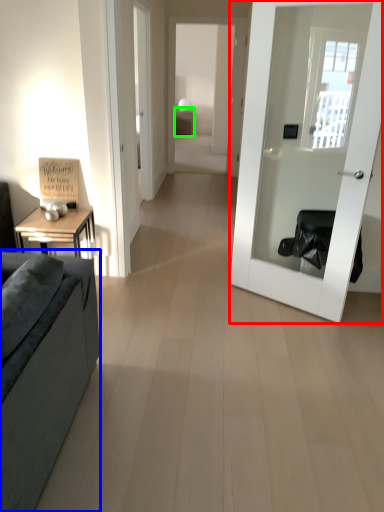
Question: Which object is the closest to the door (highlighted by a red box)? Choose among these: studio couch (highlighted by a blue box) or table (highlighted by a green box).

Choices:
 (A) studio couch
 (B) table

Answer: (A)